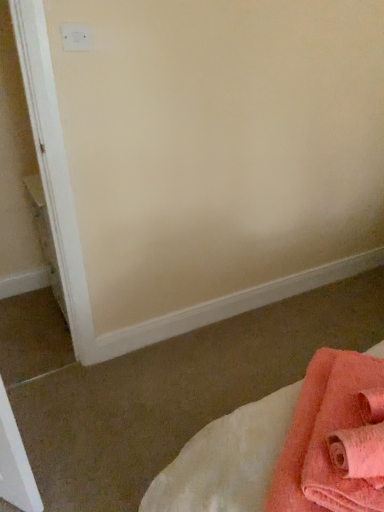
Question: Is soft coral towel at lower right beside soft pink towel at lower right?

Choices:
 (A) yes
 (B) no

Answer: (B)

Question: Does soft coral towel at lower right appear on the left side of soft pink towel at lower right?

Choices:
 (A) yes
 (B) no

Answer: (A)

Question: From a real-world perspective, is soft coral towel at lower right located beneath soft pink towel at lower right?

Choices:
 (A) no
 (B) yes

Answer: (B)

Question: Does soft coral towel at lower right have a lesser height compared to soft pink towel at lower right?

Choices:
 (A) no
 (B) yes

Answer: (A)

Question: Does soft coral towel at lower right have a lesser width compared to soft pink towel at lower right?

Choices:
 (A) no
 (B) yes

Answer: (B)

Question: Is the position of soft coral towel at lower right more distant than that of soft pink towel at lower right?

Choices:
 (A) yes
 (B) no

Answer: (B)

Question: Can you confirm if white plastic electric outlet at upper left is shorter than soft pink towel at lower right?

Choices:
 (A) no
 (B) yes

Answer: (A)

Question: Is white plastic electric outlet at upper left positioned beyond the bounds of soft pink towel at lower right?

Choices:
 (A) yes
 (B) no

Answer: (A)

Question: Is white plastic electric outlet at upper left turned away from soft pink towel at lower right?

Choices:
 (A) no
 (B) yes

Answer: (A)

Question: Does white plastic electric outlet at upper left come behind soft pink towel at lower right?

Choices:
 (A) yes
 (B) no

Answer: (A)

Question: From the image's perspective, is white plastic electric outlet at upper left over soft pink towel at lower right?

Choices:
 (A) no
 (B) yes

Answer: (B)

Question: From a real-world perspective, is white plastic electric outlet at upper left located beneath soft pink towel at lower right?

Choices:
 (A) no
 (B) yes

Answer: (A)

Question: Does soft pink towel at lower right have a larger size compared to white plastic electric outlet at upper left?

Choices:
 (A) no
 (B) yes

Answer: (B)